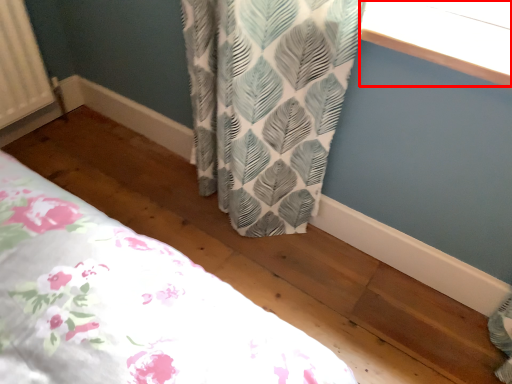
Question: Considering the relative positions of window screen (annotated by the red box) and bed in the image provided, where is window screen (annotated by the red box) located with respect to the staircase?

Choices:
 (A) left
 (B) right

Answer: (B)